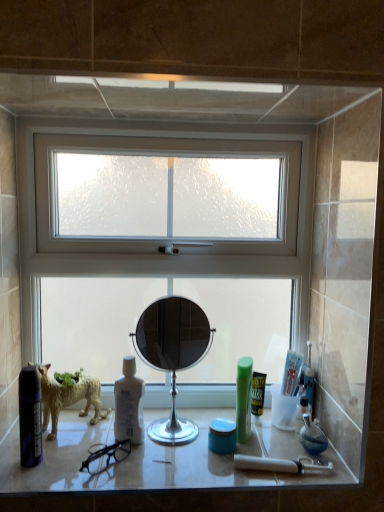
Locate an element on the screen. The width and height of the screenshot is (384, 512). free space to the left of silver/metallic mirror at center is located at coordinates (106, 446).